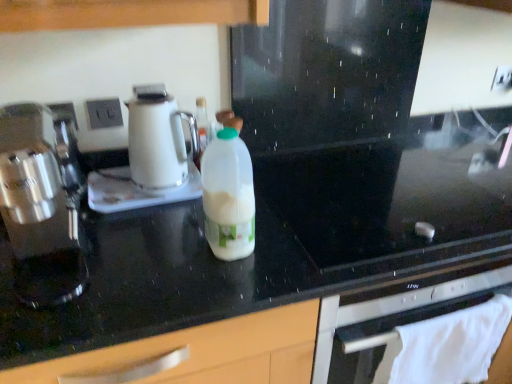
Find the location of a particular element. The image size is (512, 384). vacant region to the right of satin silver coffee maker at left, which is counted as the second kitchen appliance, starting from the back is located at coordinates (157, 255).